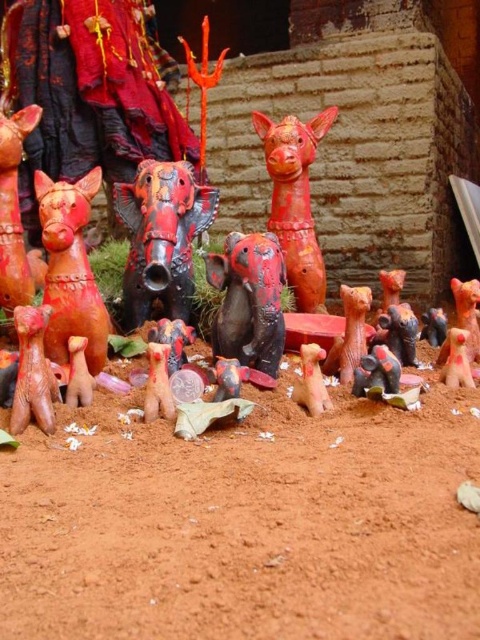
You are standing in front of the figurines on the reddishbrown soil. You need to place a new decorative bell exactly halfway between the shiny red and black statue at center and the textured mud brick wall in the background. Can you determine if there is enough space between them to place the bell?

The shiny red and black statue at center is located at point [160,237], so the halfway point between it and the textured mud brick wall in the background would be at [320,440]. There is sufficient space to place the bell there.

You are an art curator planning to display the shiny red and black statue at center and the matte clay pig at center in a new exhibition. Which of the two objects should be placed on a higher pedestal to ensure both are visible from the front row of seats?

The shiny red and black statue at center is taller than the matte clay pig at center, so placing it on a higher pedestal would ensure both are visible from the front row of seats.